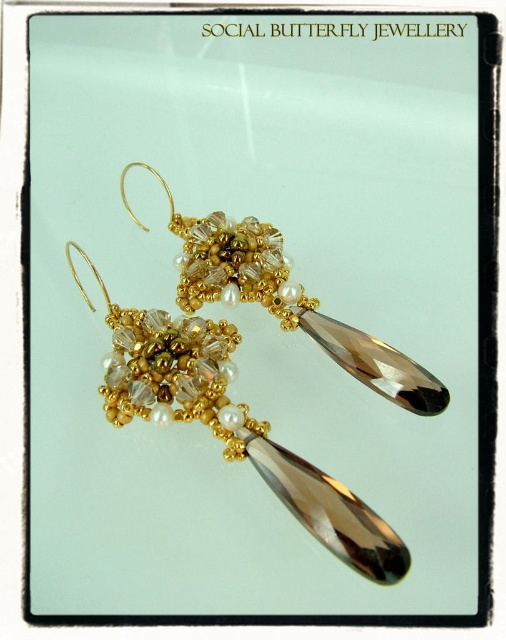
Between smoky quartz teardrop at center and gold beaded cluster at center, which one appears on the right side from the viewer's perspective?

gold beaded cluster at center is more to the right.

Who is lower down, smoky quartz teardrop at center or gold beaded cluster at center?

smoky quartz teardrop at center is lower down.

Image resolution: width=506 pixels, height=640 pixels. In order to click on smoky quartz teardrop at center in this screenshot , I will do `click(232, 426)`.

Identify the location of smoky quartz teardrop at center. (232, 426).